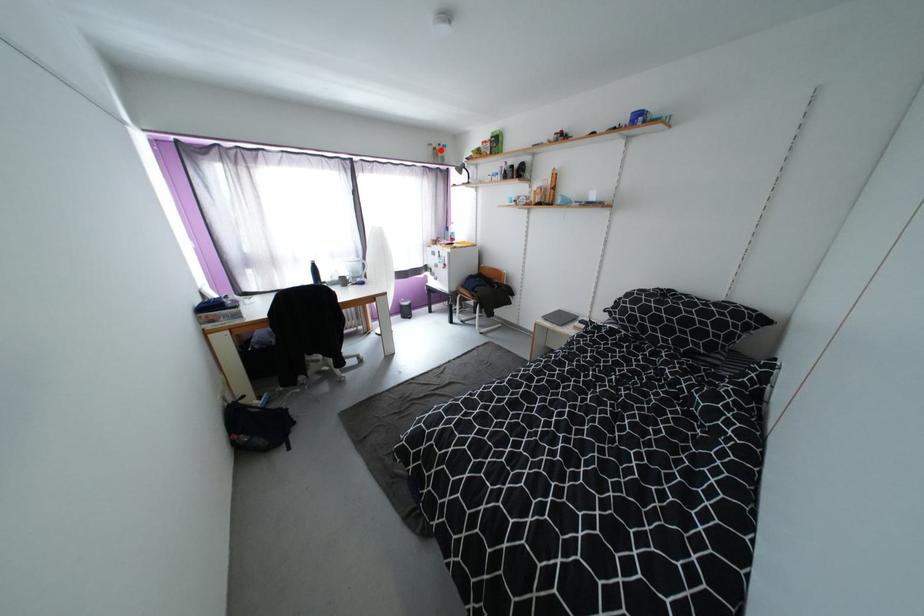
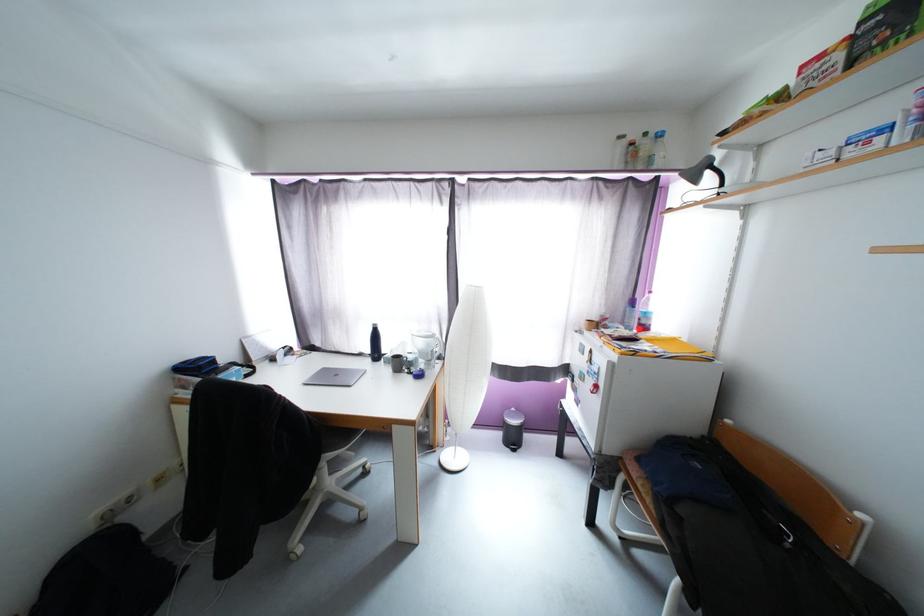
Question: I am providing you with two images of the same scene from different viewpoints. A red point is shown in image1. For the corresponding object point in image2, is it positioned nearer or farther from the camera?

Choices:
 (A) Nearer
 (B) Farther

Answer: (B)